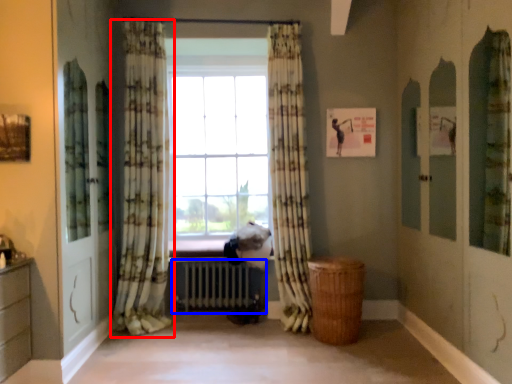
Question: Which point is further to the camera, curtain (highlighted by a red box) or radiator (highlighted by a blue box)?

Choices:
 (A) curtain
 (B) radiator

Answer: (B)